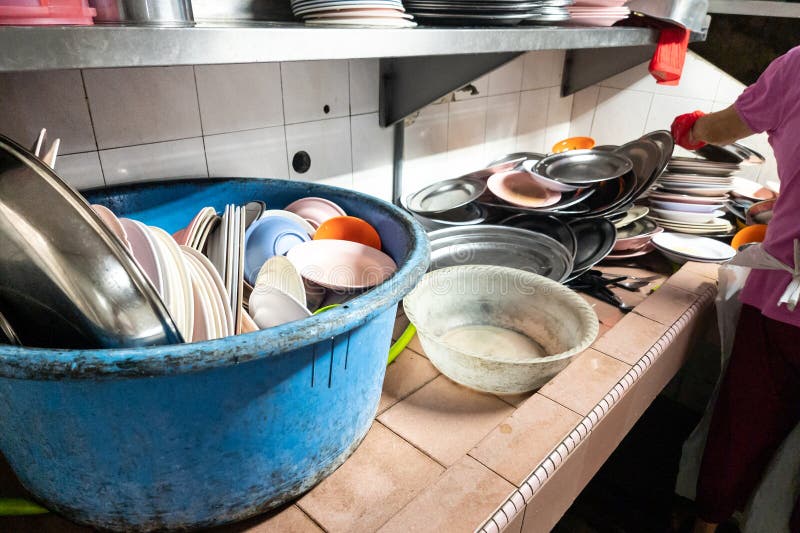
Identify the location of tile countertop. (420, 421), (492, 444), (678, 276), (356, 495).